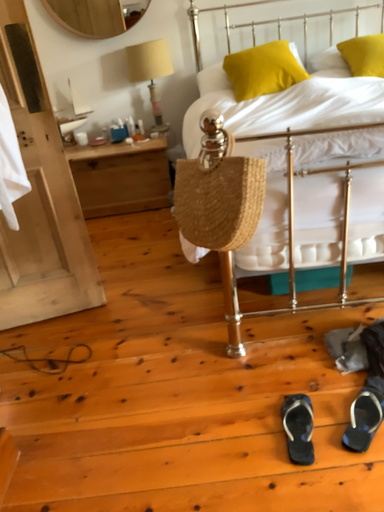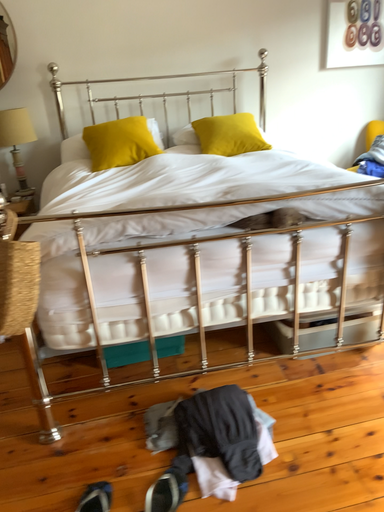
Question: How did the camera likely rotate when shooting the video?

Choices:
 (A) rotated upward
 (B) rotated downward

Answer: (A)